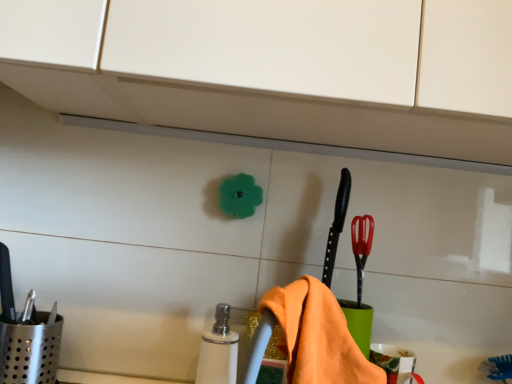
Question: Can you confirm if red plastic brush at right is positioned to the left of white glossy soap dispenser at center?

Choices:
 (A) no
 (B) yes

Answer: (A)

Question: Is red plastic brush at right shorter than white glossy soap dispenser at center?

Choices:
 (A) no
 (B) yes

Answer: (B)

Question: Could you tell me if red plastic brush at right is facing white glossy soap dispenser at center?

Choices:
 (A) yes
 (B) no

Answer: (B)

Question: Does red plastic brush at right lie in front of white glossy soap dispenser at center?

Choices:
 (A) yes
 (B) no

Answer: (B)

Question: Does red plastic brush at right contain white glossy soap dispenser at center?

Choices:
 (A) yes
 (B) no

Answer: (B)

Question: Considering the relative positions of red plastic brush at right and white glossy soap dispenser at center in the image provided, is red plastic brush at right to the right of white glossy soap dispenser at center from the viewer's perspective?

Choices:
 (A) yes
 (B) no

Answer: (A)

Question: Is orange cotton towel at lower center oriented away from white glossy soap dispenser at center?

Choices:
 (A) yes
 (B) no

Answer: (B)

Question: Could you tell me if orange cotton towel at lower center is turned towards white glossy soap dispenser at center?

Choices:
 (A) yes
 (B) no

Answer: (B)

Question: Is orange cotton towel at lower center positioned beyond the bounds of white glossy soap dispenser at center?

Choices:
 (A) yes
 (B) no

Answer: (A)

Question: Can you confirm if orange cotton towel at lower center is smaller than white glossy soap dispenser at center?

Choices:
 (A) no
 (B) yes

Answer: (A)

Question: Considering the relative sizes of orange cotton towel at lower center and white glossy soap dispenser at center in the image provided, is orange cotton towel at lower center thinner than white glossy soap dispenser at center?

Choices:
 (A) yes
 (B) no

Answer: (B)

Question: Does orange cotton towel at lower center have a lesser height compared to white glossy soap dispenser at center?

Choices:
 (A) no
 (B) yes

Answer: (B)

Question: From a real-world perspective, is red plastic brush at right positioned under orange cotton towel at lower center based on gravity?

Choices:
 (A) no
 (B) yes

Answer: (A)